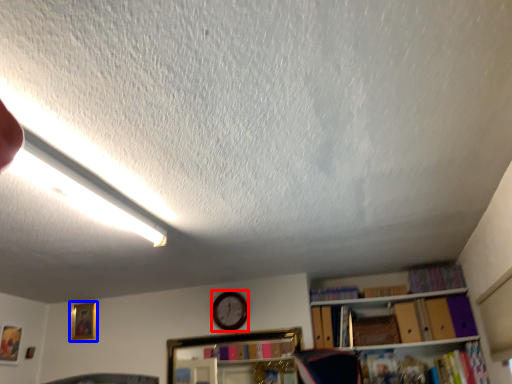
Question: Which object is closer to the camera taking this photo, clock (highlighted by a red box) or picture frame (highlighted by a blue box)?

Choices:
 (A) clock
 (B) picture frame

Answer: (A)